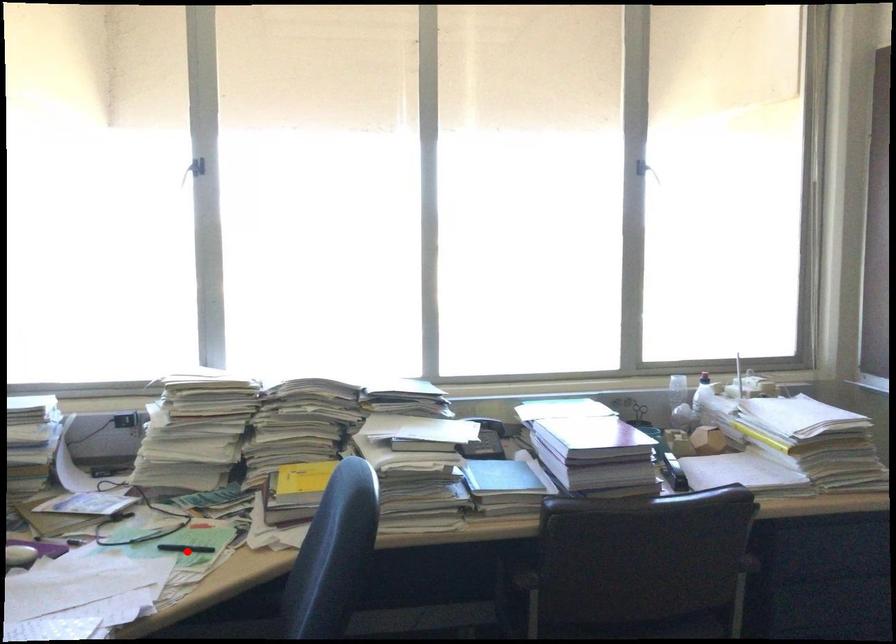
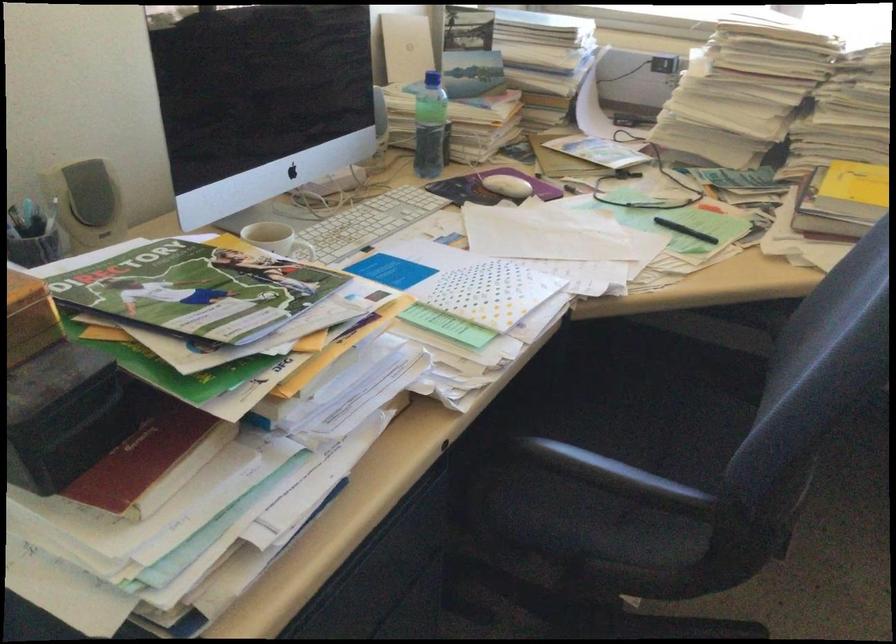
Where in the second image is the point corresponding to the highlighted location from the first image?

(684, 230)